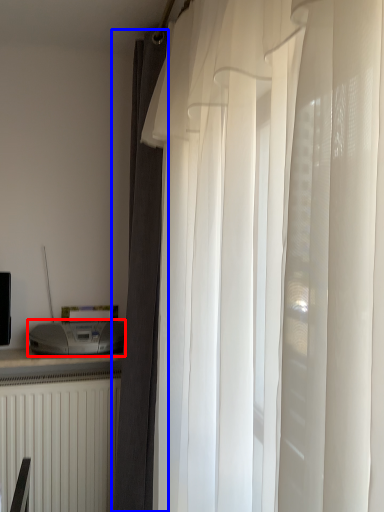
Question: Among these objects, which one is farthest to the camera, appliance (highlighted by a red box) or curtain (highlighted by a blue box)?

Choices:
 (A) appliance
 (B) curtain

Answer: (A)